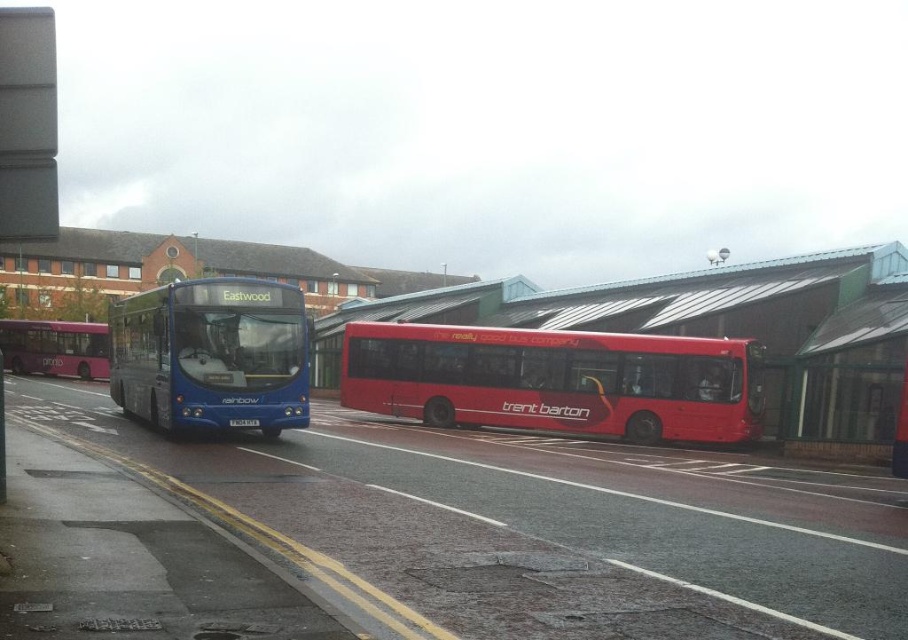
Which is behind, point (368, 400) or point (123, 365)?

The point (368, 400) is behind.

Does shiny red bus at center have a greater width compared to matte blue bus at left?

Indeed, shiny red bus at center has a greater width compared to matte blue bus at left.

Identify the location of shiny red bus at center. This screenshot has height=640, width=908. (554, 380).

Does shiny red bus at center have a greater width compared to matte purple bus at left?

Indeed, shiny red bus at center has a greater width compared to matte purple bus at left.

Is point (421, 385) closer to viewer compared to point (2, 339)?

Yes, it is.

I want to click on shiny red bus at center, so click(554, 380).

Can you confirm if matte blue bus at left is bigger than matte purple bus at left?

Correct, matte blue bus at left is larger in size than matte purple bus at left.

Does matte blue bus at left have a lesser width compared to matte purple bus at left?

Indeed, matte blue bus at left has a lesser width compared to matte purple bus at left.

Is point (129, 381) positioned after point (70, 364)?

No, (129, 381) is closer to viewer.

Image resolution: width=908 pixels, height=640 pixels. Find the location of `matte blue bus at left`. matte blue bus at left is located at coordinates (212, 355).